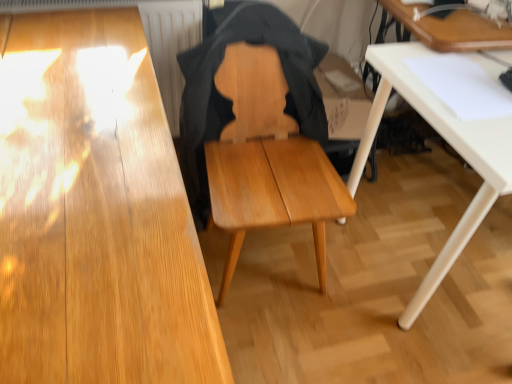
What are the coordinates of `white matte table at lower right, positioned as the 2th table in top-to-bottom order` in the screenshot? It's located at (449, 143).

Identify the location of light brown wood chair at center. The width and height of the screenshot is (512, 384). (259, 132).

From the picture: Does light brown wood chair at center have a lesser width compared to white matte table at lower right, positioned as the 2th table in top-to-bottom order?

Correct, the width of light brown wood chair at center is less than that of white matte table at lower right, positioned as the 2th table in top-to-bottom order.

Which of these two, light brown wood chair at center or white matte table at lower right, positioned as the 2th table in top-to-bottom order, stands taller?

Standing taller between the two is light brown wood chair at center.

From the image's perspective, is light brown wood chair at center on white matte table at lower right, positioned as the 2th table in top-to-bottom order?

Yes, from the image's perspective, light brown wood chair at center is over white matte table at lower right, positioned as the 2th table in top-to-bottom order.

Which point is more distant from viewer, (215, 154) or (489, 144)?

The point (215, 154) is more distant.

Could you tell me if wooden table at upper right, marked as the 2th table in a bottom-to-top arrangement, is facing white matte table at lower right, positioned as the 2th table in top-to-bottom order?

No, wooden table at upper right, marked as the 2th table in a bottom-to-top arrangement, is not oriented towards white matte table at lower right, positioned as the 2th table in top-to-bottom order.

In the scene shown: From a real-world perspective, does wooden table at upper right, marked as the 2th table in a bottom-to-top arrangement, stand above white matte table at lower right, arranged as the 1th table when ordered from the bottom?

Yes, from a real-world perspective, wooden table at upper right, marked as the 2th table in a bottom-to-top arrangement, is over white matte table at lower right, arranged as the 1th table when ordered from the bottom

Is wooden table at upper right, marked as the 2th table in a bottom-to-top arrangement, spatially inside white matte table at lower right, positioned as the 2th table in top-to-bottom order, or outside of it?

wooden table at upper right, marked as the 2th table in a bottom-to-top arrangement, exists outside the volume of white matte table at lower right, positioned as the 2th table in top-to-bottom order.

Measure the distance between wooden table at upper right, which is the first table from top to bottom, and light brown wood chair at center.

wooden table at upper right, which is the first table from top to bottom, and light brown wood chair at center are 54.18 centimeters apart from each other.

At what (x,y) coordinates should I click in order to perform the action: click on chair in front of the wooden table at upper right, marked as the 2th table in a bottom-to-top arrangement. Please return your answer as a coordinate pair (x, y). Image resolution: width=512 pixels, height=384 pixels. Looking at the image, I should click on (259, 132).

Is wooden table at upper right, which is the first table from top to bottom, positioned with its back to light brown wood chair at center?

No, wooden table at upper right, which is the first table from top to bottom, is not facing away from light brown wood chair at center.

From a real-world perspective, which is physically below, wooden table at upper right, which is the first table from top to bottom, or light brown wood chair at center?

From a 3D spatial view, light brown wood chair at center is below.

Does light brown wood chair at center appear on the left side of wooden table at upper right, marked as the 2th table in a bottom-to-top arrangement?

Correct, you'll find light brown wood chair at center to the left of wooden table at upper right, marked as the 2th table in a bottom-to-top arrangement.

Where is `chair in front of the wooden table at upper right, which is the first table from top to bottom`? The image size is (512, 384). chair in front of the wooden table at upper right, which is the first table from top to bottom is located at coordinates (259, 132).

Is wooden table at upper right, marked as the 2th table in a bottom-to-top arrangement, at the back of light brown wood chair at center?

No, wooden table at upper right, marked as the 2th table in a bottom-to-top arrangement, is not at the back of light brown wood chair at center.

Between white matte table at lower right, positioned as the 2th table in top-to-bottom order, and light brown wood chair at center, which one has smaller size?

Smaller between the two is light brown wood chair at center.

Which of these two, white matte table at lower right, arranged as the 1th table when ordered from the bottom, or light brown wood chair at center, is thinner?

light brown wood chair at center.

Who is shorter, white matte table at lower right, arranged as the 1th table when ordered from the bottom, or light brown wood chair at center?

With less height is white matte table at lower right, arranged as the 1th table when ordered from the bottom.

Is white matte table at lower right, positioned as the 2th table in top-to-bottom order, facing towards light brown wood chair at center?

No.

Can you tell me how much white matte table at lower right, positioned as the 2th table in top-to-bottom order, and wooden table at upper right, which is the first table from top to bottom, differ in facing direction?

white matte table at lower right, positioned as the 2th table in top-to-bottom order, and wooden table at upper right, which is the first table from top to bottom, are facing 1.19 degrees away from each other.

Measure the distance from white matte table at lower right, positioned as the 2th table in top-to-bottom order, to wooden table at upper right, which is the first table from top to bottom.

22.33 centimeters.

Where is `table lying behind the white matte table at lower right, positioned as the 2th table in top-to-bottom order`? The height and width of the screenshot is (384, 512). table lying behind the white matte table at lower right, positioned as the 2th table in top-to-bottom order is located at coordinates (452, 29).

From a real-world perspective, between white matte table at lower right, positioned as the 2th table in top-to-bottom order, and wooden table at upper right, marked as the 2th table in a bottom-to-top arrangement, who is vertically lower?

white matte table at lower right, positioned as the 2th table in top-to-bottom order.

Locate an element on the screen. table below the light brown wood chair at center (from a real-world perspective) is located at coordinates (449, 143).

Locate an element on the screen. This screenshot has width=512, height=384. table that appears behind the white matte table at lower right, arranged as the 1th table when ordered from the bottom is located at coordinates (452, 29).

From the image, which object appears to be farther from wooden table at upper right, which is the first table from top to bottom, white matte table at lower right, positioned as the 2th table in top-to-bottom order, or light brown wood chair at center?

Among the two, light brown wood chair at center is located further to wooden table at upper right, which is the first table from top to bottom.

From the image, which object appears to be farther from light brown wood chair at center, wooden table at upper right, which is the first table from top to bottom, or white matte table at lower right, positioned as the 2th table in top-to-bottom order?

The object further to light brown wood chair at center is wooden table at upper right, which is the first table from top to bottom.

From the image, which object appears to be farther from light brown wood chair at center, white matte table at lower right, positioned as the 2th table in top-to-bottom order, or wooden table at upper right, marked as the 2th table in a bottom-to-top arrangement?

wooden table at upper right, marked as the 2th table in a bottom-to-top arrangement, is further to light brown wood chair at center.

Consider the image. Estimate the real-world distances between objects in this image. Which object is closer to white matte table at lower right, arranged as the 1th table when ordered from the bottom, light brown wood chair at center or wooden table at upper right, marked as the 2th table in a bottom-to-top arrangement?

wooden table at upper right, marked as the 2th table in a bottom-to-top arrangement, is closer to white matte table at lower right, arranged as the 1th table when ordered from the bottom.

From the picture: When comparing their distances from white matte table at lower right, positioned as the 2th table in top-to-bottom order, does wooden table at upper right, marked as the 2th table in a bottom-to-top arrangement, or light brown wood chair at center seem closer?

wooden table at upper right, marked as the 2th table in a bottom-to-top arrangement, lies closer to white matte table at lower right, positioned as the 2th table in top-to-bottom order, than the other object.

Based on their spatial positions, is light brown wood chair at center or white matte table at lower right, positioned as the 2th table in top-to-bottom order, further from wooden table at upper right, which is the first table from top to bottom?

Based on the image, light brown wood chair at center appears to be further to wooden table at upper right, which is the first table from top to bottom.

The width and height of the screenshot is (512, 384). I want to click on table between light brown wood chair at center and white matte table at lower right, arranged as the 1th table when ordered from the bottom, so click(452, 29).